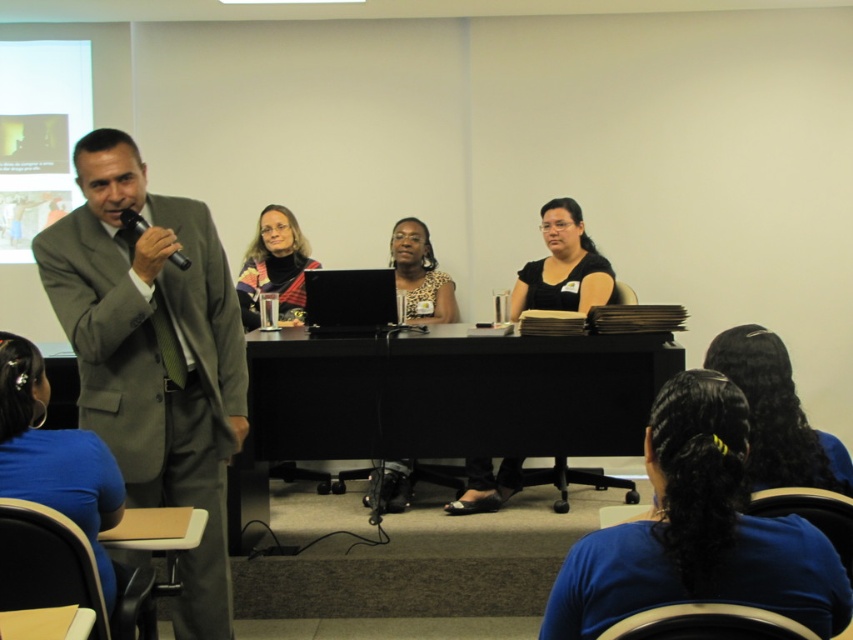
Can you confirm if black hair at lower right is positioned above black matte shirt at center?

No, black hair at lower right is not above black matte shirt at center.

Which is behind, point (791, 410) or point (515, 490)?

Point (515, 490)

You are a GUI agent. You are given a task and a screenshot of the screen. Output one action in this format:
    pyautogui.click(x=<x>, y=<y>)
    Task: Click on the black hair at lower right
    
    Given the screenshot: What is the action you would take?
    pyautogui.click(x=776, y=416)

Does blue fabric shirt at lower left have a lesser width compared to black hair at lower right?

Correct, blue fabric shirt at lower left's width is less than black hair at lower right's.

In the scene shown: Measure the distance from blue fabric shirt at lower left to black hair at lower right.

The distance of blue fabric shirt at lower left from black hair at lower right is 1.63 meters.

What do you see at coordinates (54, 456) in the screenshot?
I see `blue fabric shirt at lower left` at bounding box center [54, 456].

The image size is (853, 640). I want to click on blue fabric shirt at lower left, so click(54, 456).

Is blue fabric hair tie at lower right above blue fabric shirt at lower left?

No, blue fabric hair tie at lower right is not above blue fabric shirt at lower left.

Who is lower down, blue fabric hair tie at lower right or blue fabric shirt at lower left?

blue fabric hair tie at lower right is lower down.

Does point (782, 525) lie in front of point (90, 468)?

Yes, it is.

You are a GUI agent. You are given a task and a screenshot of the screen. Output one action in this format:
    pyautogui.click(x=<x>, y=<y>)
    Task: Click on the blue fabric hair tie at lower right
    
    Given the screenshot: What is the action you would take?
    pyautogui.click(x=698, y=531)